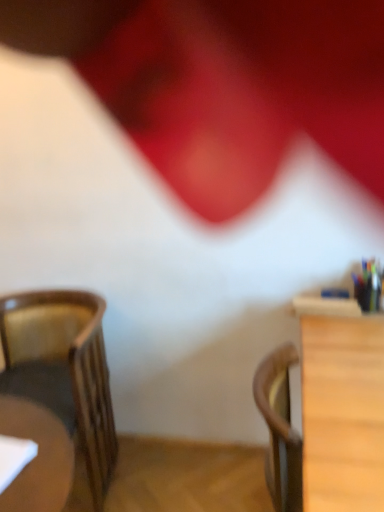
Describe the element at coordinates (342, 407) in the screenshot. I see `wooden table at right` at that location.

Where is `wooden table at right`? The width and height of the screenshot is (384, 512). wooden table at right is located at coordinates (342, 407).

This screenshot has height=512, width=384. What do you see at coordinates (63, 370) in the screenshot?
I see `wooden chair at left` at bounding box center [63, 370].

At what (x,y) coordinates should I click in order to perform the action: click on wooden chair at left. Please return your answer as a coordinate pair (x, y). Looking at the image, I should click on (63, 370).

Locate an element on the screen. The height and width of the screenshot is (512, 384). wooden table at right is located at coordinates (342, 407).

Which is more to the right, wooden table at right or wooden chair at left?

From the viewer's perspective, wooden table at right appears more on the right side.

Is the position of wooden table at right more distant than that of wooden chair at left?

No, wooden table at right is closer to the viewer.

Is point (308, 437) positioned after point (91, 484)?

No.

Consider the image. From the image's perspective, relative to wooden chair at left, is wooden table at right above or below?

Clearly, from the image's perspective, wooden table at right is below wooden chair at left.

From a real-world perspective, between wooden table at right and wooden chair at left, who is vertically lower?

wooden chair at left, from a real-world perspective.

Looking at their sizes, would you say wooden table at right is wider or thinner than wooden chair at left?

Considering their sizes, wooden table at right looks slimmer than wooden chair at left.

Does wooden table at right have a lesser height compared to wooden chair at left?

Yes, wooden table at right is shorter than wooden chair at left.

Can you confirm if wooden table at right is smaller than wooden chair at left?

Yes.

Would you say wooden table at right contains wooden chair at left?

No.

Is there a large distance between wooden table at right and wooden chair at left?

wooden table at right is near wooden chair at left, not far away.

Is wooden table at right looking in the opposite direction of wooden chair at left?

Yes, wooden table at right's orientation is away from wooden chair at left.

What's the angular difference between wooden table at right and wooden chair at left's facing directions?

There is a 79.7-degree angle between the facing directions of wooden table at right and wooden chair at left.

Identify the location of table below the wooden chair at left (from the image's perspective). (342, 407).

Based on their positions, is wooden chair at left located to the left or right of wooden table at right?

Clearly, wooden chair at left is on the left of wooden table at right in the image.

Is wooden chair at left in front of or behind wooden table at right in the image?

wooden chair at left is positioned farther from the viewer than wooden table at right.

Is point (61, 408) behind point (359, 382)?

Yes, it is.

From the image's perspective, who appears lower, wooden chair at left or wooden table at right?

wooden table at right, from the image's perspective.

From a real-world perspective, is wooden chair at left physically above wooden table at right?

No, from a real-world perspective, wooden chair at left is not on top of wooden table at right.

Considering the relative sizes of wooden chair at left and wooden table at right in the image provided, is wooden chair at left thinner than wooden table at right?

No, wooden chair at left is not thinner than wooden table at right.

From their relative heights in the image, would you say wooden chair at left is taller or shorter than wooden table at right?

Clearly, wooden chair at left is taller compared to wooden table at right.

Considering the relative sizes of wooden chair at left and wooden table at right in the image provided, is wooden chair at left smaller than wooden table at right?

No, wooden chair at left is not smaller than wooden table at right.

Do you think wooden chair at left is within wooden table at right, or outside of it?

wooden chair at left cannot be found inside wooden table at right.

Is wooden chair at left in contact with wooden table at right?

wooden chair at left is not next to wooden table at right, and they're not touching.

Is wooden chair at left aimed at wooden table at right?

No, wooden chair at left does not turn towards wooden table at right.

Measure the distance from wooden chair at left to wooden table at right.

37.56 inches.

Identify the location of table below the wooden chair at left (from the image's perspective). (342, 407).

I want to click on table that appears on the right of wooden chair at left, so click(x=342, y=407).

The width and height of the screenshot is (384, 512). In order to click on table above the wooden chair at left (from a real-world perspective) in this screenshot , I will do (x=342, y=407).